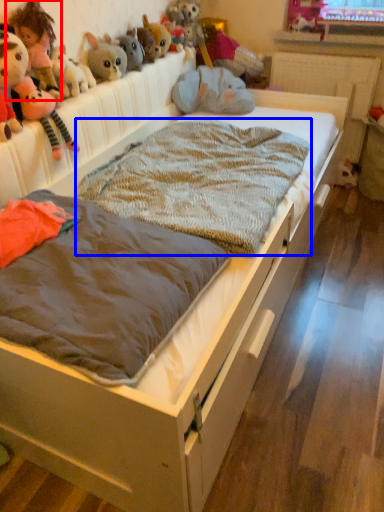
Question: Which object is closer to the camera taking this photo, toy (highlighted by a red box) or blanket (highlighted by a blue box)?

Choices:
 (A) toy
 (B) blanket

Answer: (B)